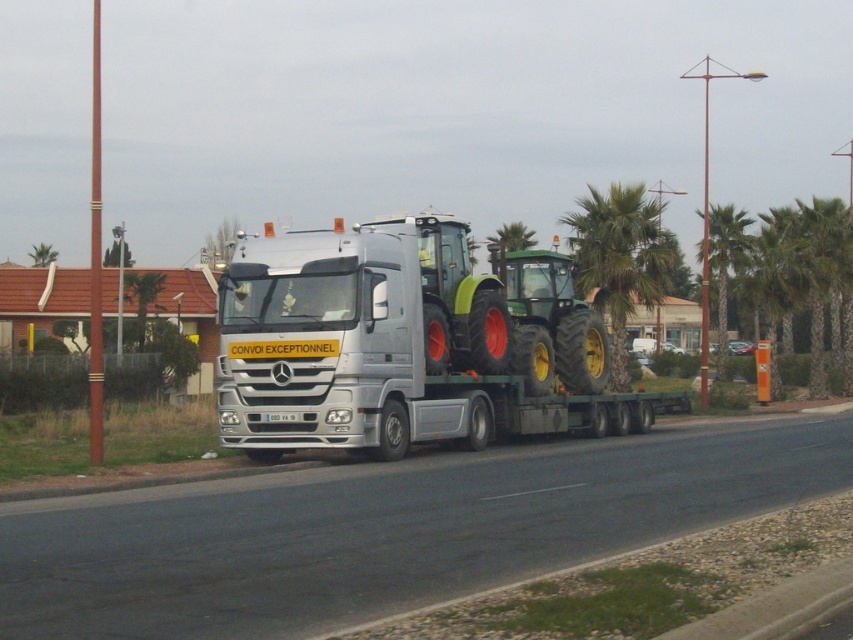
In the scene shown: You are standing at a safe distance from the large silver Mercedes truck carrying two tractors. The truck has a yellow sign on the front bumper. There is a point marked at coordinates point (x=350, y=280). Is this point within a 100 feet safety zone around the truck?

The point (x=350, y=280) is 67.82 feet away from the viewer, which is within the 100 feet safety zone around the truck.

You are a pedestrian standing on the sidewalk and see the silver metallic truck at center approaching you. If the truck is moving at 15 km per hour, how many seconds will it take for the truck to reach you?

The silver metallic truck at center is 20.27 meters away from the viewer. At a speed of 15 km per hour, which converts to approximately 4.19 meters per second, it will take roughly 20.27 divided by 4.19 equals approximately 4.84 seconds for the truck to reach the viewer.